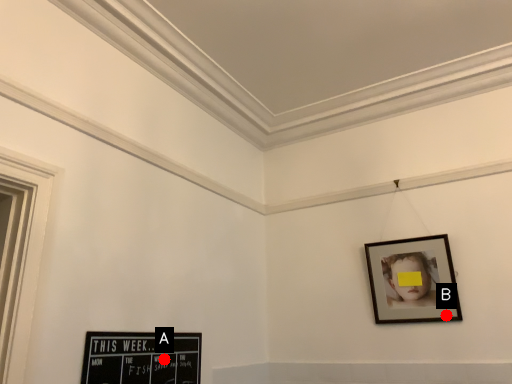
Question: Two points are circled on the image, labeled by A and B beside each circle. Which point appears closest to the camera in this image?

Choices:
 (A) A is closer
 (B) B is closer

Answer: (A)